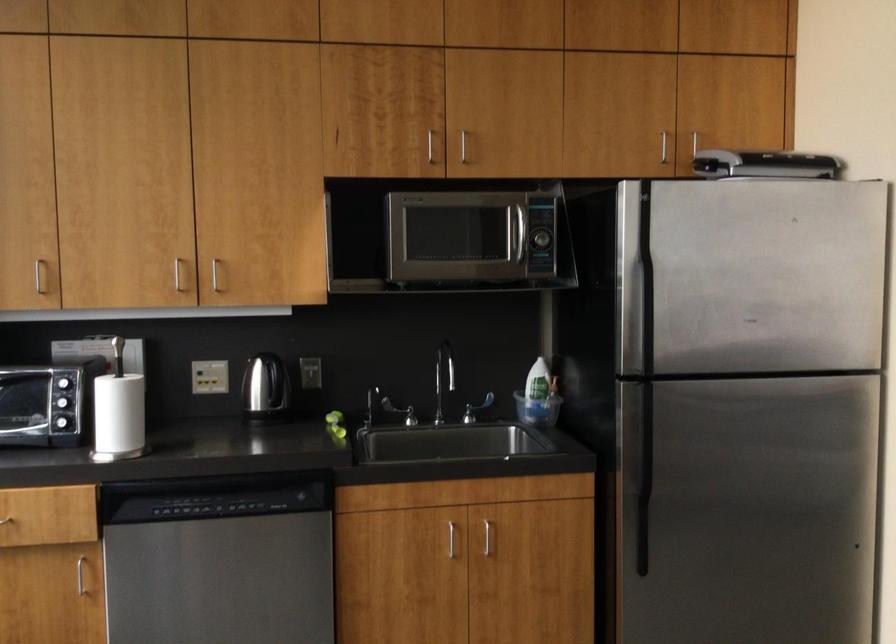
Identify the location of silver drawer handle. This screenshot has width=896, height=644. (450, 538).